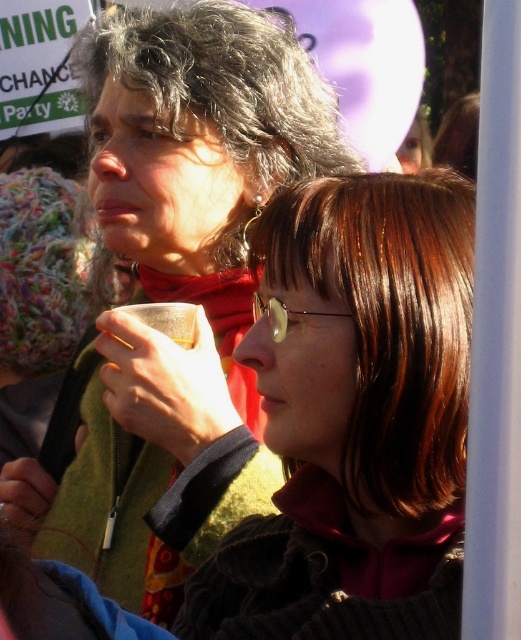
You are a photographer trying to capture a candid shot of the two people in the scene. You want to ensure that both the matte black jacket at upper center and the brown hair at center are clearly visible in the frame. Based on their relative heights, which object should you focus on first to ensure proper depth of field?

The matte black jacket at upper center has a greater height compared to the brown hair at center, so you should focus on the matte black jacket at upper center first to ensure proper depth of field since it is taller and might be further away.

You are standing at the center of the image. You want to move towards the matte black jacket at upper center. In which direction should you move?

Since the matte black jacket at upper center is located at coordinate point 0.459 on the x axis and 0.334 on the y axis, you should move towards the upper center direction to reach it.

You are a photographer trying to capture a candid shot of the two people in the scene. You notice the matte black jacket at upper center and the brown hair at center. Which object is positioned higher in the image?

The matte black jacket at upper center is positioned higher than the brown hair at center.